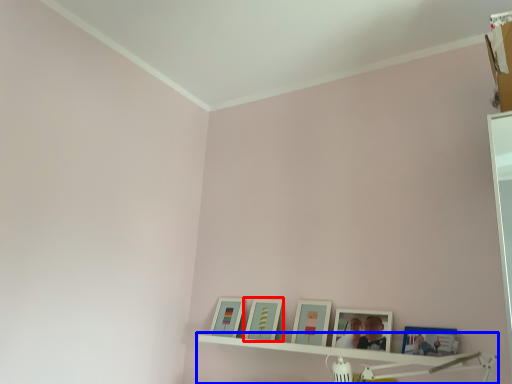
Question: Which object appears farthest to the camera in this image, picture frame (highlighted by a red box) or shelf (highlighted by a blue box)?

Choices:
 (A) picture frame
 (B) shelf

Answer: (A)